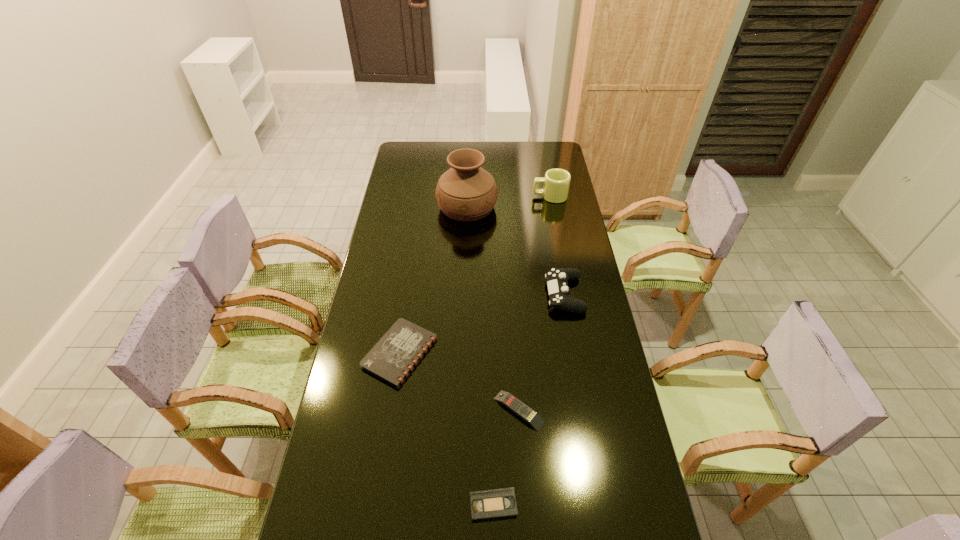
Identify the location of the tallest object. This screenshot has height=540, width=960. (466, 192).

Locate an element on the screen. The width and height of the screenshot is (960, 540). the fifth shortest object is located at coordinates (556, 181).

Locate an element on the screen. The image size is (960, 540). control is located at coordinates (557, 278).

Locate an element on the screen. This screenshot has height=540, width=960. the fourth nearest object is located at coordinates (557, 278).

Where is `notebook`? This screenshot has height=540, width=960. notebook is located at coordinates (394, 356).

Locate an element on the screen. This screenshot has width=960, height=540. remote control is located at coordinates (511, 402).

Where is `videotape`? videotape is located at coordinates (498, 503).

The image size is (960, 540). I want to click on the nearest object, so click(x=498, y=503).

This screenshot has height=540, width=960. I want to click on free space located 0.100m on the right of the urn, so 519,207.

Locate an element on the screen. Image resolution: width=960 pixels, height=540 pixels. vacant space situated with the handle on the side of the mug is located at coordinates (513, 197).